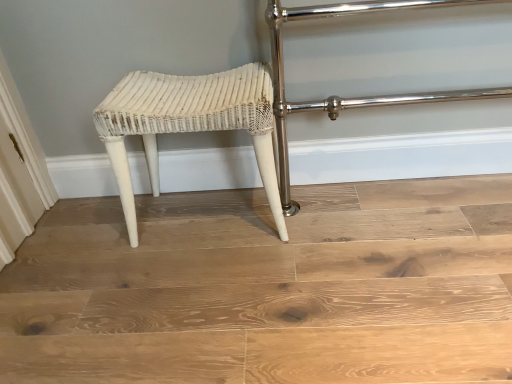
Question: From the image's perspective, would you say white wicker stool at center is shown under white wicker stool at center?

Choices:
 (A) yes
 (B) no

Answer: (B)

Question: From a real-world perspective, does white wicker stool at center stand above white wicker stool at center?

Choices:
 (A) yes
 (B) no

Answer: (A)

Question: From a real-world perspective, is white wicker stool at center positioned under white wicker stool at center based on gravity?

Choices:
 (A) no
 (B) yes

Answer: (A)

Question: Can white wicker stool at center be found inside white wicker stool at center?

Choices:
 (A) no
 (B) yes

Answer: (A)

Question: Is white wicker stool at center touching white wicker stool at center?

Choices:
 (A) yes
 (B) no

Answer: (B)

Question: Would you say white wicker stool at center is a long distance from white wicker stool at center?

Choices:
 (A) no
 (B) yes

Answer: (A)

Question: Are white wicker stool at center and white wicker stool at center far apart?

Choices:
 (A) no
 (B) yes

Answer: (A)

Question: Is the depth of white wicker stool at center greater than that of white wicker stool at center?

Choices:
 (A) yes
 (B) no

Answer: (B)

Question: Could white wicker stool at center be considered to be inside white wicker stool at center?

Choices:
 (A) yes
 (B) no

Answer: (B)

Question: From the image's perspective, is white wicker stool at center located beneath white wicker stool at center?

Choices:
 (A) yes
 (B) no

Answer: (A)

Question: From a real-world perspective, does white wicker stool at center stand above white wicker stool at center?

Choices:
 (A) yes
 (B) no

Answer: (B)

Question: Is white wicker stool at center outside white wicker stool at center?

Choices:
 (A) yes
 (B) no

Answer: (A)

Question: Considering the positions of white wicker stool at center and white wicker stool at center in the image, is white wicker stool at center bigger or smaller than white wicker stool at center?

Choices:
 (A) small
 (B) big

Answer: (A)